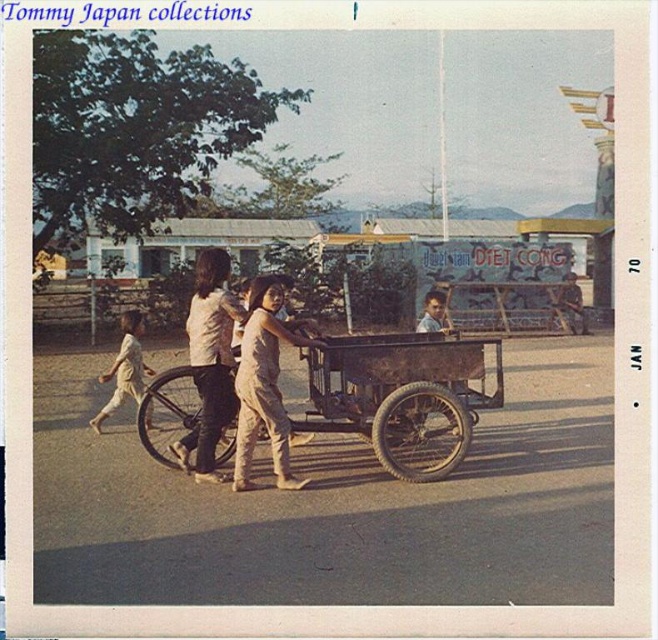
You are standing at the point marked by the coordinates (401,396) in the image. What object are you currently positioned at?

You are positioned at the brown wooden wagon at center, which is represented by the point (401,396).

You are standing next to a camera that is 6.43 meters away from the brown wooden wagon at center. If you want to take a photo of the wagon, would you need to use a telephoto lens to capture the entire wagon in the frame?

The brown wooden wagon at center is 6.43 meters away from the camera. Whether a telephoto lens is needed depends on the camera sensor size, lens focal length, and desired field of view. However, at this distance, a standard lens might suffice for capturing the wagon in full, but a telephoto could help isolate it from the background.